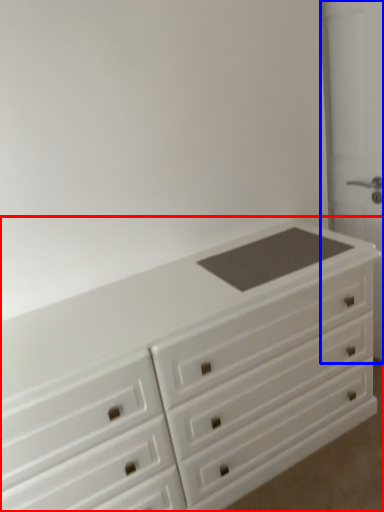
Question: Which object appears closest to the camera in this image, chest of drawers (highlighted by a red box) or screen door (highlighted by a blue box)?

Choices:
 (A) chest of drawers
 (B) screen door

Answer: (A)